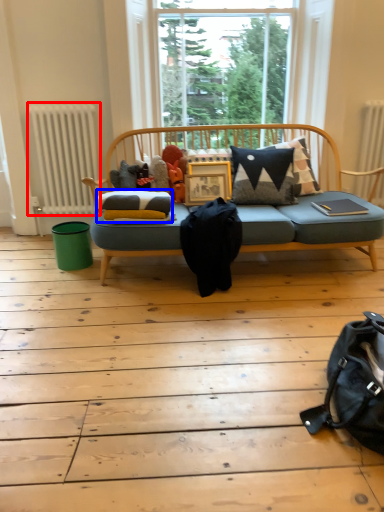
Question: Which point is further to the camera, radiator (highlighted by a red box) or mattress (highlighted by a blue box)?

Choices:
 (A) radiator
 (B) mattress

Answer: (A)